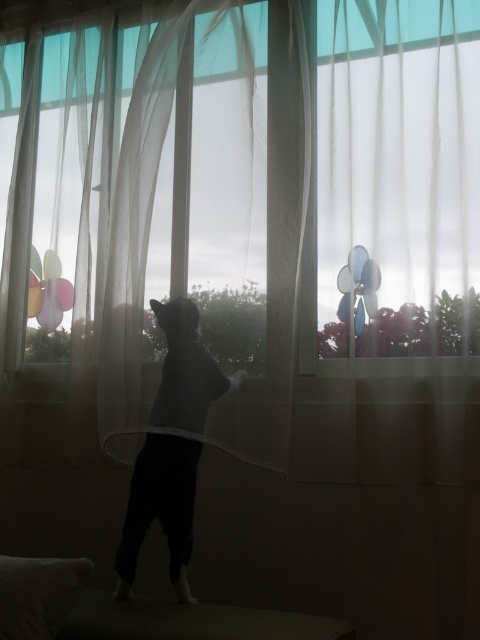
Question: Among these points, which one is nearest to the camera?

Choices:
 (A) (173, 320)
 (B) (64, 577)

Answer: (B)

Question: Can you confirm if silhouette fur at center is positioned to the right of white soft pillow at lower left?

Choices:
 (A) yes
 (B) no

Answer: (A)

Question: Is the position of silhouette fur at center less distant than that of white soft pillow at lower left?

Choices:
 (A) yes
 (B) no

Answer: (B)

Question: Among these points, which one is farthest from the camera?

Choices:
 (A) (145, 496)
 (B) (85, 568)
 (C) (208, 625)

Answer: (A)

Question: Is dark brown wooden stool at lower center below silhouette fur at center?

Choices:
 (A) no
 (B) yes

Answer: (B)

Question: Which point appears farthest from the camera in this image?

Choices:
 (A) (66, 611)
 (B) (90, 611)
 (C) (147, 467)

Answer: (C)